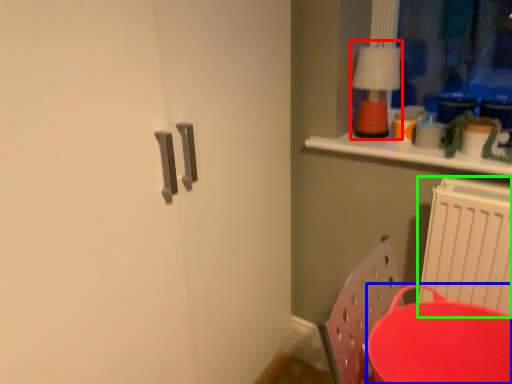
Question: Estimate the real-world distances between objects in this image. Which object is farther from lamp (highlighted by a red box), round table (highlighted by a blue box) or radiator (highlighted by a green box)?

Choices:
 (A) round table
 (B) radiator

Answer: (A)